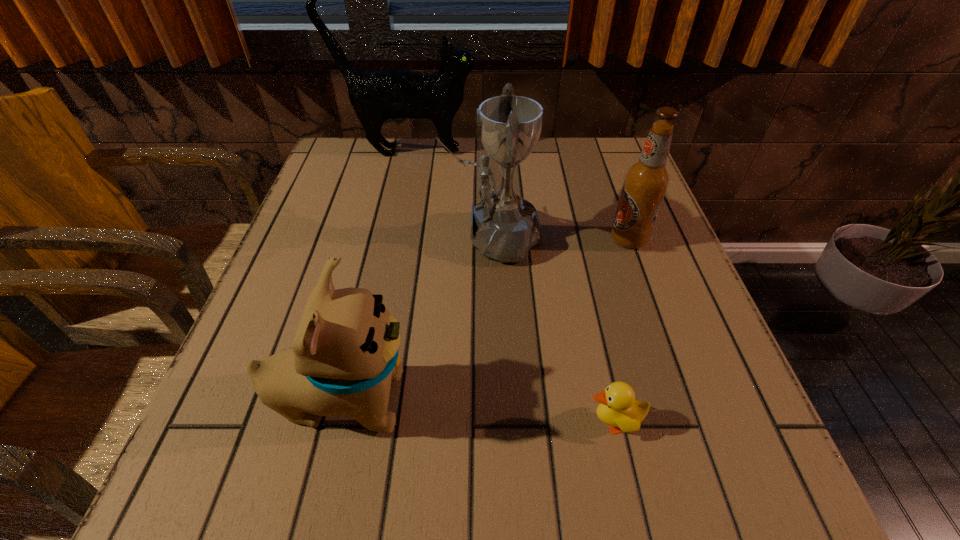
I want to click on puppy located in the left edge section of the desktop, so click(344, 356).

This screenshot has height=540, width=960. I want to click on object situated at the right edge, so click(x=645, y=183).

You are a GUI agent. You are given a task and a screenshot of the screen. Output one action in this format:
    pyautogui.click(x=<x>, y=<y>)
    Task: Click on the object that is positioned at the far left corner
    The height and width of the screenshot is (540, 960).
    Given the screenshot: What is the action you would take?
    pyautogui.click(x=376, y=95)

In the image, there is a desktop. Where is `free region at the far edge`? Image resolution: width=960 pixels, height=540 pixels. free region at the far edge is located at coordinates (492, 166).

The height and width of the screenshot is (540, 960). I want to click on vacant space at the near edge of the desktop, so click(x=358, y=508).

At what (x,y) coordinates should I click in order to perform the action: click on free space at the left edge of the desktop. Please return your answer as a coordinate pair (x, y). This screenshot has width=960, height=540. Looking at the image, I should click on (260, 308).

The width and height of the screenshot is (960, 540). I want to click on free space at the right edge of the desktop, so click(x=621, y=299).

The height and width of the screenshot is (540, 960). Identify the location of vacant position at the far left corner of the desktop. point(348,137).

Find the location of a particular element. vacant space at the near left corner of the desktop is located at coordinates (243, 512).

You are a GUI agent. You are given a task and a screenshot of the screen. Output one action in this format:
    pyautogui.click(x=<x>, y=<y>)
    Task: Click on the vacant space at the far right corner
    
    Given the screenshot: What is the action you would take?
    pyautogui.click(x=578, y=159)